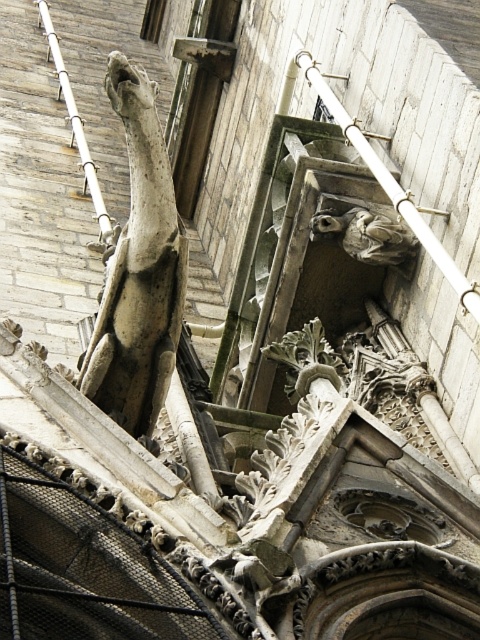
From the picture: What are the 2D coordinates of the gray stone gargoyle at upper left in the image?

The gray stone gargoyle at upper left is located at the 2D coordinates of point (139, 269).